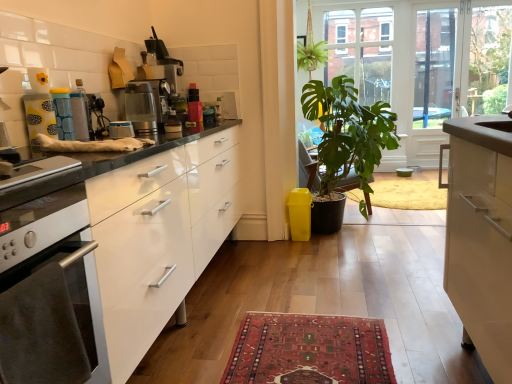
Question: Considering their positions, is clear glass screen door at upper right located in front of or behind matte blue canister at center, acting as the 2th appliance starting from the right?

Choices:
 (A) behind
 (B) front

Answer: (A)

Question: From the image's perspective, is clear glass screen door at upper right positioned above or below matte blue canister at center, which is counted as the second appliance, starting from the left?

Choices:
 (A) above
 (B) below

Answer: (A)

Question: Which is nearer to the green matte plant at center?

Choices:
 (A) clear glass screen door at upper right
 (B) silver metallic oven at left
 (C) transparent glass door at upper center
 (D) yellow plastic trash bin/can at lower right
 (E) brushed metal toaster at center, which appears as the 3th appliance when viewed from the left

Answer: (D)

Question: Which of these objects is positioned farthest from the brushed metal toaster at center, which appears as the 3th appliance when viewed from the left?

Choices:
 (A) transparent glass door at upper center
 (B) metallic silver coffee maker at center
 (C) matte yellow container at upper left, arranged as the 1th appliance when viewed from the left
 (D) satin silver coffee machine at upper center
 (E) yellow plastic trash bin/can at lower right

Answer: (A)